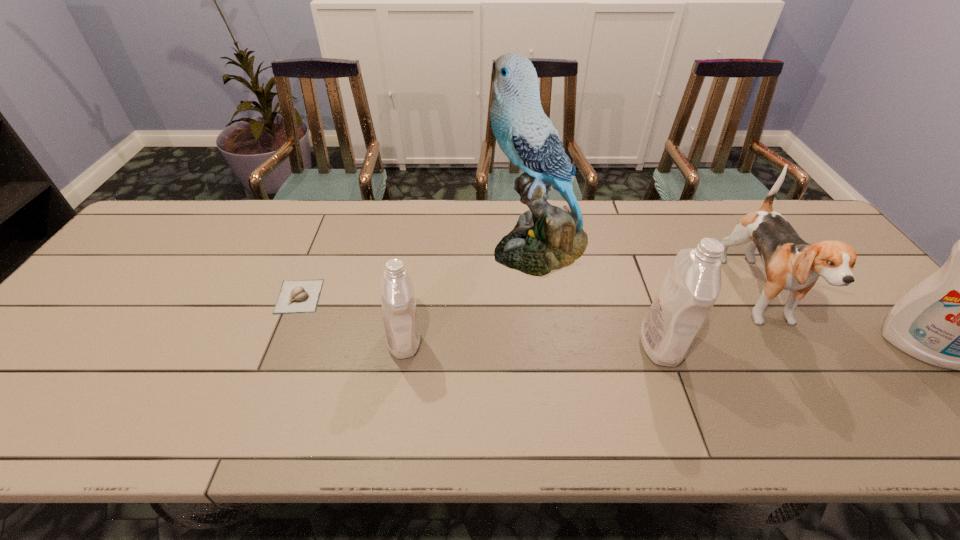
In the image, there is a desktop. Identify the location of vacant region at the right edge. (851, 323).

This screenshot has width=960, height=540. In the image, there is a desktop. In order to click on vacant area at the far left corner in this screenshot , I will do `click(173, 227)`.

Identify the location of free space between the garlic and the tallest object. Image resolution: width=960 pixels, height=540 pixels. tap(419, 272).

I want to click on vacant area that lies between the tallest object and the shortest detergent, so click(471, 294).

Identify the location of vacant area that lies between the second tallest detergent and the shortest object. (480, 320).

You are a GUI agent. You are given a task and a screenshot of the screen. Output one action in this format:
    pyautogui.click(x=<x>, y=<y>)
    Task: Click on the vacant area that lies between the fourth object from left to right and the leftmost detergent
    Image resolution: width=960 pixels, height=540 pixels.
    Given the screenshot: What is the action you would take?
    pyautogui.click(x=533, y=342)

Find the location of `free spot between the fourth object from right to left and the garlic`. free spot between the fourth object from right to left and the garlic is located at coordinates (419, 272).

In order to click on free spot between the puppy and the second shortest detergent in this screenshot , I will do `click(710, 321)`.

Find the location of a particular element. the closest object to the tallest detergent is located at coordinates (790, 263).

This screenshot has height=540, width=960. Identify the location of object identified as the closest to the rightmost object. (x=790, y=263).